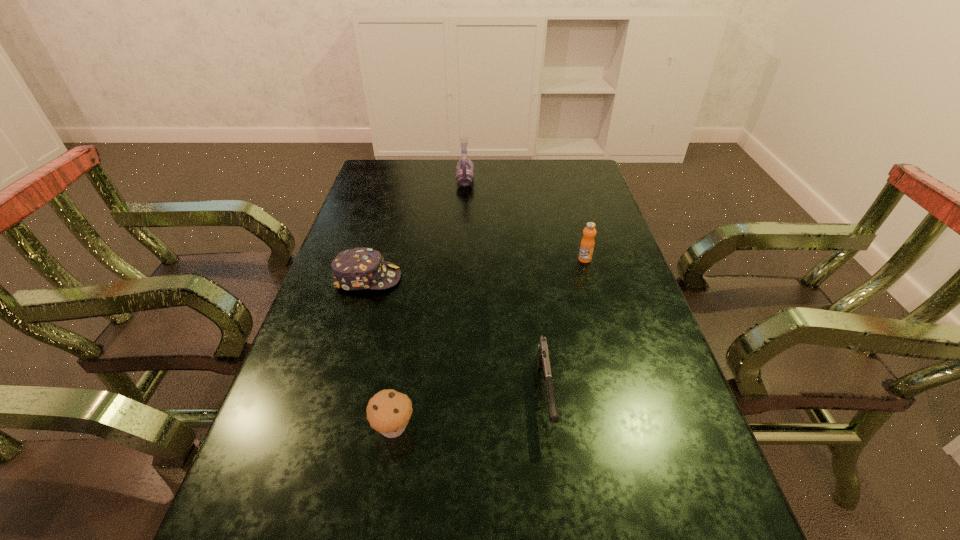
In order to click on vacant space located 0.060m on the back of the second object from left to right in this screenshot , I will do `click(400, 382)`.

The image size is (960, 540). Identify the location of vacant space situated 0.150m at the muzzle end of the second object from right to left. (562, 523).

Identify the location of object that is positioned at the far edge. This screenshot has height=540, width=960. (465, 167).

Find the location of a particular element. This screenshot has height=540, width=960. object that is positioned at the left edge is located at coordinates (360, 268).

The image size is (960, 540). I want to click on object that is at the right edge, so click(587, 244).

Find the location of a particular element. The image size is (960, 540). vacant space at the far edge of the desktop is located at coordinates click(514, 181).

Find the location of `free space at the left edge of the desktop`. free space at the left edge of the desktop is located at coordinates (353, 232).

In the image, there is a desktop. Identify the location of vacant space at the right edge. The height and width of the screenshot is (540, 960). (604, 336).

In the image, there is a desktop. Identify the location of free space at the far left corner. This screenshot has width=960, height=540. (400, 170).

Where is `vacant space at the far right corner`? The image size is (960, 540). vacant space at the far right corner is located at coordinates (571, 167).